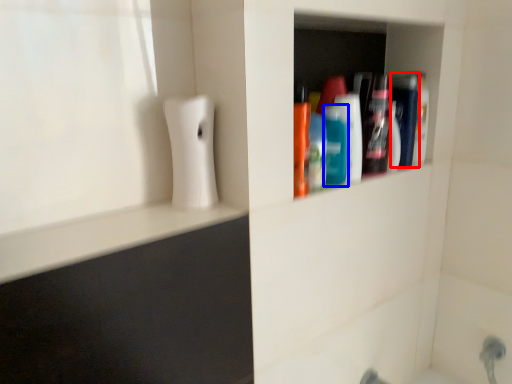
Question: Among these objects, which one is farthest to the camera, mouthwash (highlighted by a red box) or mouthwash (highlighted by a blue box)?

Choices:
 (A) mouthwash
 (B) mouthwash

Answer: (A)